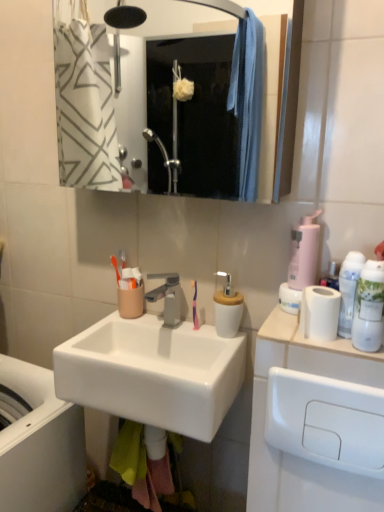
What is the approximate width of purple plastic toothbrush at center?

purple plastic toothbrush at center is 1.57 inches wide.

Describe the element at coordinates (166, 297) in the screenshot. I see `satin nickel faucet at center` at that location.

At what (x,y) coordinates should I click in order to perform the action: click on metallic silver mirror at upper center. Please return your answer as a coordinate pair (x, y). The width and height of the screenshot is (384, 512). Looking at the image, I should click on (177, 106).

The height and width of the screenshot is (512, 384). What do you see at coordinates (177, 106) in the screenshot?
I see `metallic silver mirror at upper center` at bounding box center [177, 106].

This screenshot has width=384, height=512. Describe the element at coordinates (369, 307) in the screenshot. I see `white glossy mouthwash at right, marked as the 1th mouthwash in a front-to-back arrangement` at that location.

Locate an element on the screen. Image resolution: width=384 pixels, height=512 pixels. white matte toilet paper at right is located at coordinates (313, 353).

The height and width of the screenshot is (512, 384). I want to click on counter top in front of the metallic silver mirror at upper center, so click(x=313, y=353).

Between white matte toilet paper at right and metallic silver mirror at upper center, which one has smaller width?

metallic silver mirror at upper center.

Is metallic silver mirror at upper center turned away from white plastic mouthwash at right, which is counted as the 1th mouthwash, starting from the back?

That's not correct — metallic silver mirror at upper center is not looking away from white plastic mouthwash at right, which is counted as the 1th mouthwash, starting from the back.

In the scene shown: From a real-world perspective, between metallic silver mirror at upper center and white plastic mouthwash at right, which is counted as the 1th mouthwash, starting from the back, who is vertically higher?

metallic silver mirror at upper center is physically above.

In the scene shown: Is metallic silver mirror at upper center far away from white plastic mouthwash at right, the second mouthwash when ordered from front to back?

That's right, there is a large distance between metallic silver mirror at upper center and white plastic mouthwash at right, the second mouthwash when ordered from front to back.

Do you think metallic silver mirror at upper center is within white plastic mouthwash at right, which is counted as the 1th mouthwash, starting from the back, or outside of it?

metallic silver mirror at upper center is not enclosed by white plastic mouthwash at right, which is counted as the 1th mouthwash, starting from the back.

How much distance is there between white matte toilet paper at right and pink matte soap dispenser at right?

They are 7.55 inches apart.

Is white matte toilet paper at right oriented towards pink matte soap dispenser at right?

No, white matte toilet paper at right is not aimed at pink matte soap dispenser at right.

The image size is (384, 512). Find the location of `soap dispenser located above the white matte toilet paper at right (from a real-world perspective)`. soap dispenser located above the white matte toilet paper at right (from a real-world perspective) is located at coordinates (304, 252).

Can you tell me how much white matte toilet paper at right and pink matte soap dispenser at right differ in facing direction?

The angular difference between white matte toilet paper at right and pink matte soap dispenser at right is 0.000687 degrees.

Choose the correct answer: Is white plastic drawer at lower right inside white matte toilet paper at right or outside it?

white plastic drawer at lower right is located beyond the bounds of white matte toilet paper at right.

From a real-world perspective, relative to white matte toilet paper at right, is white plastic drawer at lower right vertically above or below?

From a real-world perspective, white plastic drawer at lower right is physically below white matte toilet paper at right.

Does point (279, 380) appear closer or farther from the camera than point (334, 344)?

Clearly, point (279, 380) is more distant from the camera than point (334, 344).

From a real-world perspective, is metallic silver mirror at upper center above or below white glossy sink at lower left?

In terms of real-world spatial position, metallic silver mirror at upper center is above white glossy sink at lower left.

Is metallic silver mirror at upper center far away from white glossy sink at lower left?

Yes.

From the image's perspective, would you say metallic silver mirror at upper center is positioned over white glossy sink at lower left?

Yes.

Find the location of a particular element. The width and height of the screenshot is (384, 512). mirror on the right side of white glossy sink at lower left is located at coordinates (177, 106).

Between white glossy sink at lower left and white glossy mouthwash at right, which is the second mouthwash in back-to-front order, which one has larger size?

With larger size is white glossy sink at lower left.

Looking at this image, is white glossy sink at lower left aimed at white glossy mouthwash at right, which is the second mouthwash in back-to-front order?

Yes, white glossy sink at lower left is turned towards white glossy mouthwash at right, which is the second mouthwash in back-to-front order.

Is white glossy sink at lower left taller than white glossy mouthwash at right, marked as the 1th mouthwash in a front-to-back arrangement?

Yes, white glossy sink at lower left is taller than white glossy mouthwash at right, marked as the 1th mouthwash in a front-to-back arrangement.

Does point (15, 438) come farther from viewer compared to point (380, 276)?

Yes, it is behind point (380, 276).

Considering the sizes of objects white plastic mouthwash at right, which is counted as the 1th mouthwash, starting from the back, and metallic silver mirror at upper center in the image provided, who is thinner, white plastic mouthwash at right, which is counted as the 1th mouthwash, starting from the back, or metallic silver mirror at upper center?

With smaller width is white plastic mouthwash at right, which is counted as the 1th mouthwash, starting from the back.

Is white plastic mouthwash at right, the second mouthwash when ordered from front to back, bigger or smaller than metallic silver mirror at upper center?

white plastic mouthwash at right, the second mouthwash when ordered from front to back, is smaller than metallic silver mirror at upper center.

From the image's perspective, starting from the metallic silver mirror at upper center, which mouthwash is the 1st one below? Please provide its 2D coordinates.

[(348, 290)]

Is white plastic mouthwash at right, which is counted as the 1th mouthwash, starting from the back, completely or partially outside of metallic silver mirror at upper center?

Yes, white plastic mouthwash at right, which is counted as the 1th mouthwash, starting from the back, is not within metallic silver mirror at upper center.

Find the location of `counter top below the metallic silver mirror at upper center (from the image's perspective)`. counter top below the metallic silver mirror at upper center (from the image's perspective) is located at coordinates (313, 353).

Where is `mirror in front of the white plastic mouthwash at right, the second mouthwash when ordered from front to back`? The image size is (384, 512). mirror in front of the white plastic mouthwash at right, the second mouthwash when ordered from front to back is located at coordinates (177, 106).

Estimate the real-world distances between objects in this image. Which object is closer to white glossy mouthwash at right, which is the second mouthwash in back-to-front order, white glossy sink at lower left or white matte toilet paper at right?

Among the two, white matte toilet paper at right is located nearer to white glossy mouthwash at right, which is the second mouthwash in back-to-front order.

When comparing their distances from metallic silver mirror at upper center, does white matte toilet paper at right or satin nickel faucet at center seem closer?

Among the two, satin nickel faucet at center is located nearer to metallic silver mirror at upper center.

Which object lies nearer to the anchor point purple plastic toothbrush at center, white glossy mouthwash at right, which is the second mouthwash in back-to-front order, or white glossy sink at center?

Based on the image, white glossy sink at center appears to be nearer to purple plastic toothbrush at center.

Looking at the image, which one is located closer to white plastic drawer at lower right, white glossy sink at center or white matte toilet paper at right?

white matte toilet paper at right.

When comparing their distances from white plastic drawer at lower right, does white plastic mouthwash at right, the second mouthwash when ordered from front to back, or purple plastic toothbrush at center seem further?

purple plastic toothbrush at center is positioned further to the anchor white plastic drawer at lower right.

Considering their positions, is white glossy sink at lower left positioned closer to purple plastic toothbrush at center than white plastic mouthwash at right, the second mouthwash when ordered from front to back?

Based on the image, white plastic mouthwash at right, the second mouthwash when ordered from front to back, appears to be nearer to purple plastic toothbrush at center.

Looking at this image, looking at the image, which one is located closer to white matte toilet paper at right, white glossy mouthwash at right, which is the second mouthwash in back-to-front order, or purple plastic toothbrush at center?

Based on the image, white glossy mouthwash at right, which is the second mouthwash in back-to-front order, appears to be nearer to white matte toilet paper at right.

Which object lies nearer to the anchor point white glossy sink at center, purple plastic toothbrush at center or white plastic mouthwash at right, which is counted as the 1th mouthwash, starting from the back?

Among the two, purple plastic toothbrush at center is located nearer to white glossy sink at center.

This screenshot has height=512, width=384. What are the coordinates of `soap dispenser between metallic silver mirror at upper center and white glossy mouthwash at right, marked as the 1th mouthwash in a front-to-back arrangement, from top to bottom` in the screenshot? It's located at (304, 252).

What are the coordinates of `soap dispenser situated between white glossy sink at lower left and white plastic mouthwash at right, the second mouthwash when ordered from front to back, from left to right` in the screenshot? It's located at (304, 252).

You are a GUI agent. You are given a task and a screenshot of the screen. Output one action in this format:
    pyautogui.click(x=<x>, y=<y>)
    Task: Click on the drawer that lies between metallic silver mirror at upper center and white glossy sink at lower left from top to bottom
    Image resolution: width=384 pixels, height=512 pixels.
    Given the screenshot: What is the action you would take?
    pyautogui.click(x=326, y=421)

This screenshot has height=512, width=384. In order to click on toothbrush located between satin nickel faucet at center and white plastic mouthwash at right, the second mouthwash when ordered from front to back, in the left-right direction in this screenshot , I will do `click(195, 307)`.